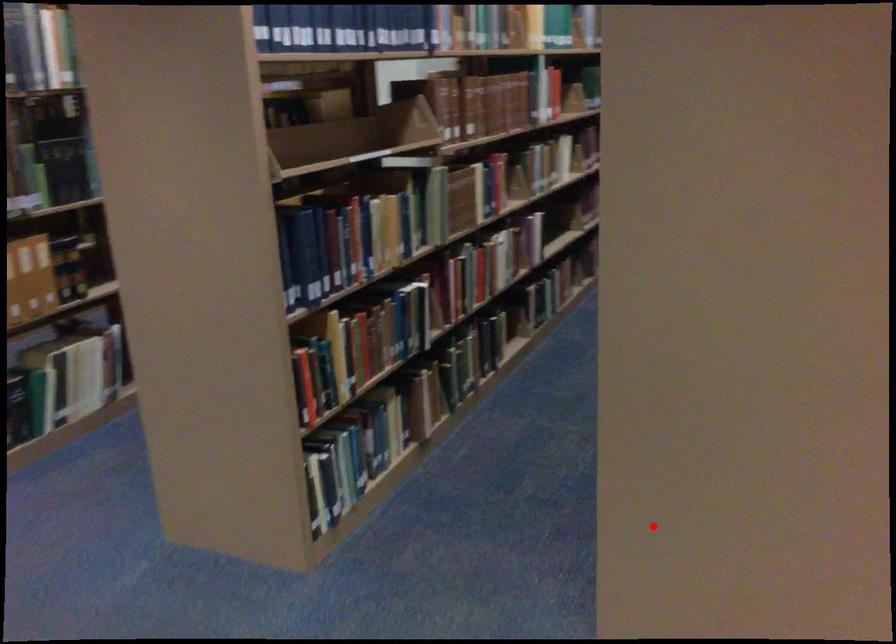
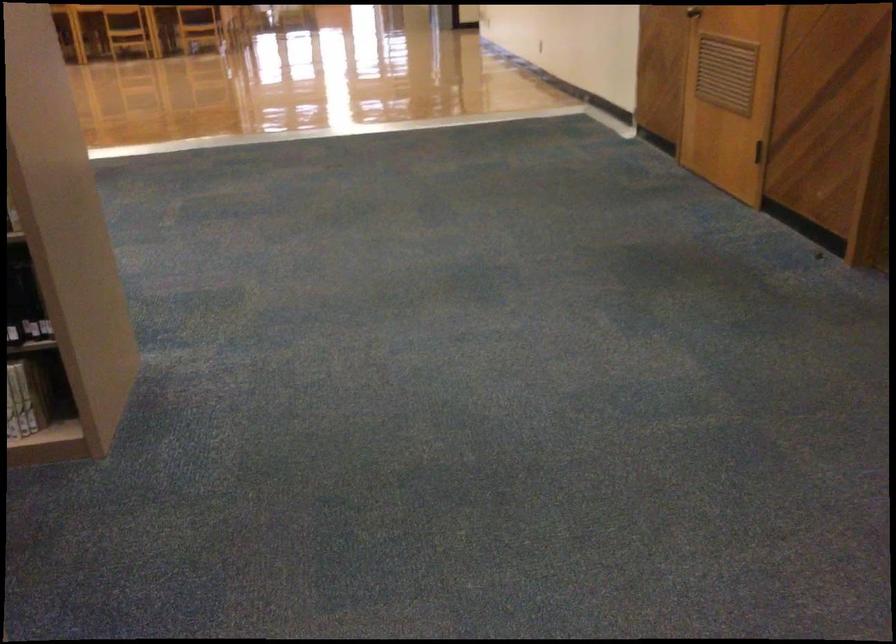
Find the pixel in the second image that matches the highlighted location in the first image.

(27, 399)